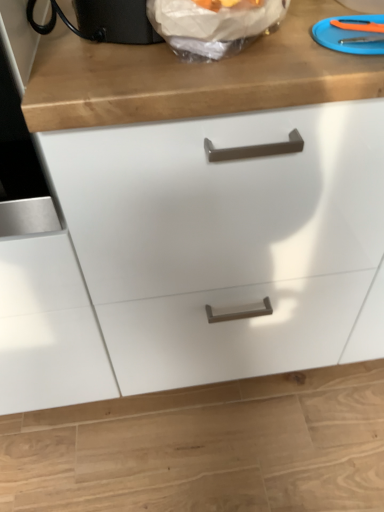
At what (x,y) coordinates should I click in order to perform the action: click on free space that is to the left of white paper bag at upper center. Please return your answer as a coordinate pair (x, y). The width and height of the screenshot is (384, 512). Looking at the image, I should click on (79, 54).